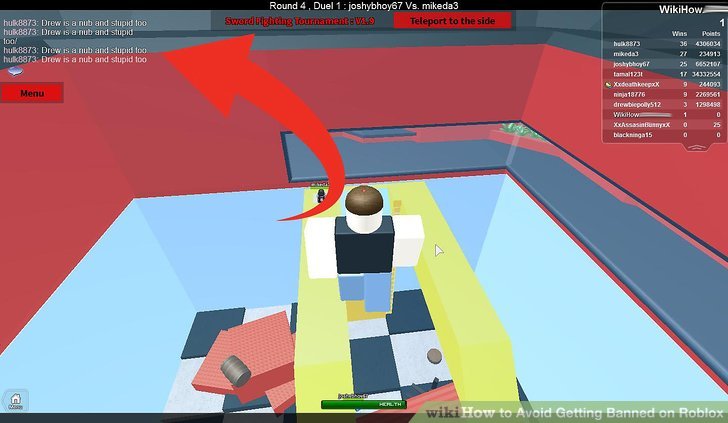
The image size is (728, 423). What are the coordinates of `virtual red walls` in the screenshot? It's located at (66, 214), (143, 147), (577, 119).